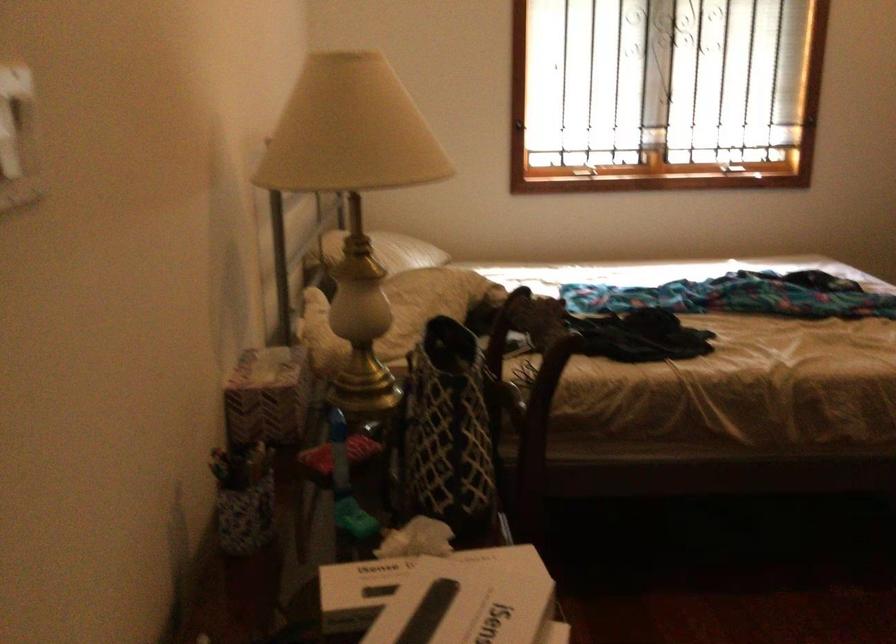
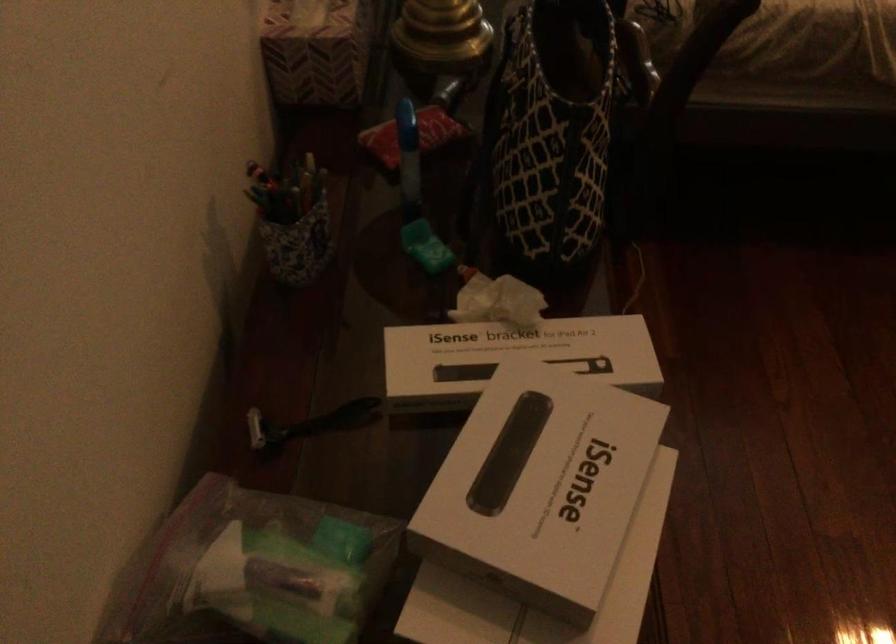
Find the pixel in the second image that matches point (243, 491) in the first image.

(291, 220)